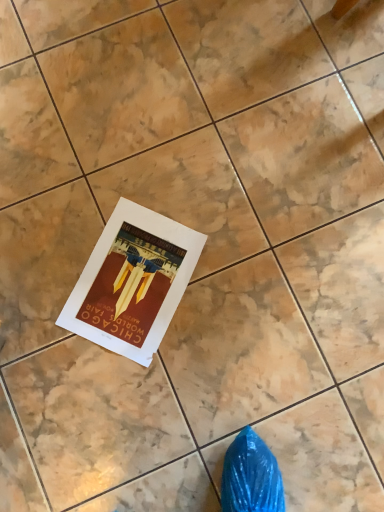
The image size is (384, 512). What do you see at coordinates (133, 282) in the screenshot?
I see `matte paper poster at center` at bounding box center [133, 282].

Identify the location of matte paper poster at center. (133, 282).

In order to click on matte paper poster at center in this screenshot , I will do `click(133, 282)`.